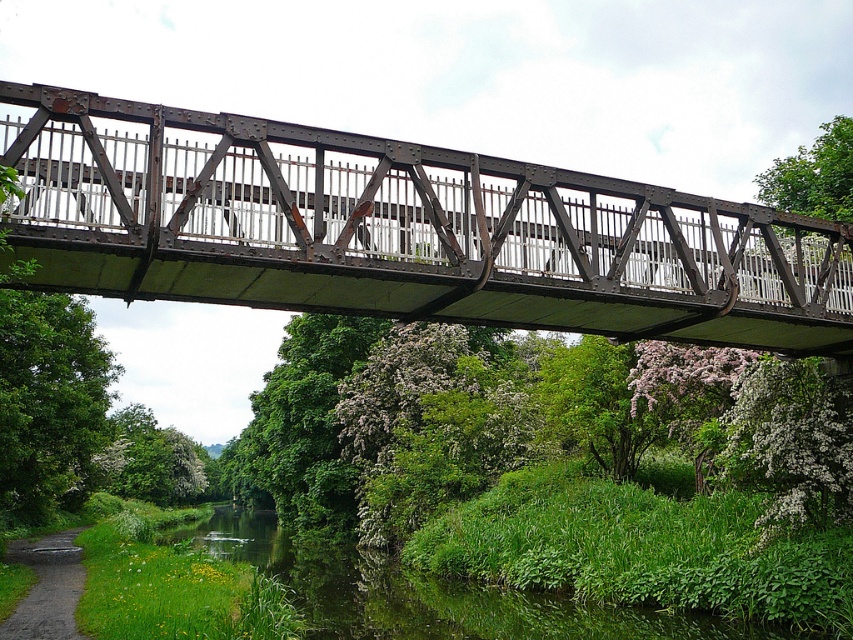
Question: Which point is closer to the camera taking this photo?

Choices:
 (A) (257, 524)
 (B) (50, 588)
 (C) (538, 268)

Answer: (C)

Question: Is rusty metal bridge at center bigger than green leafy river at lower center?

Choices:
 (A) yes
 (B) no

Answer: (B)

Question: Is green leafy river at lower center in front of gravel path at lower left?

Choices:
 (A) no
 (B) yes

Answer: (A)

Question: Estimate the real-world distances between objects in this image. Which object is closer to the green leafy river at lower center?

Choices:
 (A) gravel path at lower left
 (B) rusty metal bridge at center

Answer: (A)

Question: Considering the relative positions of rusty metal bridge at center and gravel path at lower left in the image provided, where is rusty metal bridge at center located with respect to gravel path at lower left?

Choices:
 (A) above
 (B) below

Answer: (A)

Question: Which object is farther from the camera taking this photo?

Choices:
 (A) gravel path at lower left
 (B) rusty metal bridge at center

Answer: (A)